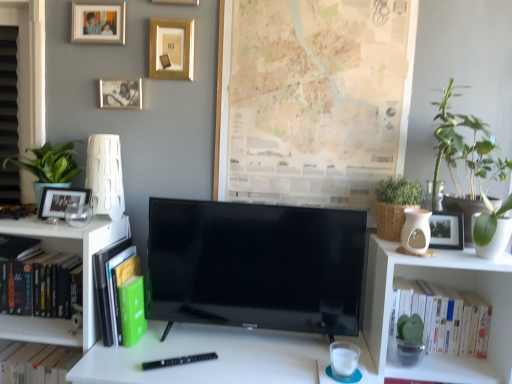
The image size is (512, 384). In order to click on white matte desk at center in this screenshot , I will do `click(209, 361)`.

Find the location of a particular element. The height and width of the screenshot is (384, 512). beige paper map at upper center is located at coordinates (313, 99).

What do you see at coordinates (113, 285) in the screenshot? This screenshot has width=512, height=384. I see `green matte book at left, placed as the 2th book when sorted from left to right` at bounding box center [113, 285].

The image size is (512, 384). What do you see at coordinates (395, 205) in the screenshot?
I see `green woven basket at right, positioned as the 2th houseplant in right-to-left order` at bounding box center [395, 205].

Find the location of a particular element. The width and height of the screenshot is (512, 384). matte gold picture frame at upper left, the 2th picture frame in the top-to-bottom sequence is located at coordinates [98, 23].

Identify the location of black matte picture frame at upper left, the second picture frame in the bottom-to-top sequence. The height and width of the screenshot is (384, 512). (121, 94).

Is green leafy plant at right, which is counted as the third houseplant, starting from the left, oriented towards beige paper map at upper center?

No.

Looking at the image, does green leafy plant at right, which is the first houseplant in right-to-left order, seem bigger or smaller compared to beige paper map at upper center?

Clearly, green leafy plant at right, which is the first houseplant in right-to-left order, is larger in size than beige paper map at upper center.

Is point (487, 154) closer or farther from the camera than point (284, 133)?

Point (487, 154) appears to be closer to the viewer than point (284, 133).

From the image's perspective, is green matte book at left, the second book from the right, over hardcover book at left, which is counted as the 1th book, starting from the left?

No, from the image's perspective, green matte book at left, the second book from the right, is not over hardcover book at left, which is counted as the 1th book, starting from the left.

In the scene shown: From a real-world perspective, is green matte book at left, placed as the 2th book when sorted from left to right, physically located above or below hardcover book at left, placed as the 3th book when sorted from right to left?

green matte book at left, placed as the 2th book when sorted from left to right, is situated higher than hardcover book at left, placed as the 3th book when sorted from right to left, in the real world.

In the scene shown: Are green matte book at left, the second book from the right, and hardcover book at left, which is counted as the 1th book, starting from the left, making contact?

No, green matte book at left, the second book from the right, is not next to hardcover book at left, which is counted as the 1th book, starting from the left.

Is green matte book at left, placed as the 2th book when sorted from left to right, located outside hardcover book at left, which is counted as the 1th book, starting from the left?

green matte book at left, placed as the 2th book when sorted from left to right, is positioned outside hardcover book at left, which is counted as the 1th book, starting from the left.

Does point (170, 1) come behind point (267, 192)?

No.

Is brushed metal picture frame at upper center, the 5th picture frame in the bottom-to-top sequence, to the left of beige paper map at upper center from the viewer's perspective?

Yes, brushed metal picture frame at upper center, the 5th picture frame in the bottom-to-top sequence, is to the left of beige paper map at upper center.

Which object is closer to the camera taking this photo, brushed metal picture frame at upper center, the 5th picture frame in the bottom-to-top sequence, or beige paper map at upper center?

beige paper map at upper center is in front.

Does brushed metal picture frame at upper center, the 5th picture frame in the bottom-to-top sequence, have a lesser height compared to beige paper map at upper center?

Indeed, brushed metal picture frame at upper center, the 5th picture frame in the bottom-to-top sequence, has a lesser height compared to beige paper map at upper center.

Considering the sizes of objects green woven basket at right, arranged as the second houseplant when viewed from the left, and black glossy tv at center in the image provided, who is taller, green woven basket at right, arranged as the second houseplant when viewed from the left, or black glossy tv at center?

With more height is black glossy tv at center.

Is green woven basket at right, arranged as the second houseplant when viewed from the left, positioned with its back to black glossy tv at center?

No, black glossy tv at center is not at the back of green woven basket at right, arranged as the second houseplant when viewed from the left.

Considering their positions, is green woven basket at right, arranged as the second houseplant when viewed from the left, located in front of or behind black glossy tv at center?

green woven basket at right, arranged as the second houseplant when viewed from the left, is behind black glossy tv at center.

Is green leafy plant at upper right inside the boundaries of black glossy tv at center, or outside?

green leafy plant at upper right is spatially situated outside black glossy tv at center.

Is green leafy plant at upper right facing towards black glossy tv at center?

No, green leafy plant at upper right is not facing towards black glossy tv at center.

Based on their sizes in the image, would you say green leafy plant at upper right is bigger or smaller than black glossy tv at center?

green leafy plant at upper right is smaller than black glossy tv at center.

From a real-world perspective, does green leafy plant at upper right stand above black glossy tv at center?

Yes, from a real-world perspective, green leafy plant at upper right is on top of black glossy tv at center.

Is point (75, 171) closer or farther from the camera than point (439, 144)?

Point (75, 171).

How distant is green matte plant at left, which is counted as the 3th houseplant, starting from the right, from green leafy plant at upper right?

A distance of 1.35 meters exists between green matte plant at left, which is counted as the 3th houseplant, starting from the right, and green leafy plant at upper right.

Is green matte plant at left, positioned as the 1th houseplant in left-to-right order, far from green leafy plant at upper right?

green matte plant at left, positioned as the 1th houseplant in left-to-right order, is positioned a significant distance from green leafy plant at upper right.

Is green matte plant at left, positioned as the 1th houseplant in left-to-right order, situated inside green leafy plant at upper right or outside?

green matte plant at left, positioned as the 1th houseplant in left-to-right order, is spatially situated outside green leafy plant at upper right.

Which point is more forward, (x=175, y=73) or (x=239, y=259)?

Point (x=239, y=259)

Who is smaller, gold metallic picture frame at upper center, placed as the 3th picture frame when sorted from top to bottom, or black glossy tv at center?

Smaller between the two is gold metallic picture frame at upper center, placed as the 3th picture frame when sorted from top to bottom.

In terms of width, does gold metallic picture frame at upper center, placed as the 3th picture frame when sorted from top to bottom, look wider or thinner when compared to black glossy tv at center?

Considering their sizes, gold metallic picture frame at upper center, placed as the 3th picture frame when sorted from top to bottom, looks slimmer than black glossy tv at center.

Where is `bulletin board above the green leafy plant at right, which is the first houseplant in right-to-left order (from a real-world perspective)`? bulletin board above the green leafy plant at right, which is the first houseplant in right-to-left order (from a real-world perspective) is located at coordinates (313, 99).

From the image's perspective, count 1st books downward from the hardcover book at left, which is counted as the 1th book, starting from the left, and point to it. Please provide its 2D coordinates.

[(113, 285)]

Based on their spatial positions, is green leafy plant at right, which is counted as the third houseplant, starting from the left, or black glossy tv at center closer to matte gold picture frame at upper left, the fourth picture frame in the bottom-to-top sequence?

Based on the image, black glossy tv at center appears to be nearer to matte gold picture frame at upper left, the fourth picture frame in the bottom-to-top sequence.

In the scene shown: Based on their spatial positions, is black glossy tv at center or green leafy plant at right, which is counted as the third houseplant, starting from the left, closer to brushed metal picture frame at upper center, the 5th picture frame in the bottom-to-top sequence?

Among the two, black glossy tv at center is located nearer to brushed metal picture frame at upper center, the 5th picture frame in the bottom-to-top sequence.

From the image, which object appears to be nearer to green matte plant at left, which is counted as the 3th houseplant, starting from the right, black glossy tv at center or beige paper map at upper center?

black glossy tv at center is positioned closer to the anchor green matte plant at left, which is counted as the 3th houseplant, starting from the right.

Which object lies further to the anchor point green leafy plant at right, which is the first houseplant in right-to-left order, matte gold picture frame at upper left, the fourth picture frame in the bottom-to-top sequence, or gold metallic picture frame at upper center, acting as the third picture frame starting from the bottom?

Based on the image, matte gold picture frame at upper left, the fourth picture frame in the bottom-to-top sequence, appears to be further to green leafy plant at right, which is the first houseplant in right-to-left order.

Looking at the image, which one is located closer to white matte book at right, which is the first book from right to left, green matte flowerpot at right or beige paper map at upper center?

The object closer to white matte book at right, which is the first book from right to left, is green matte flowerpot at right.

When comparing their distances from beige paper map at upper center, does green woven basket at right, arranged as the second houseplant when viewed from the left, or green matte book at left, placed as the 2th book when sorted from left to right, seem further?

green matte book at left, placed as the 2th book when sorted from left to right, is positioned further to the anchor beige paper map at upper center.

Consider the image. Estimate the real-world distances between objects in this image. Which object is closer to brushed metal picture frame at upper center, which ranks as the 1th picture frame in top-to-bottom order, green leafy plant at right, which is counted as the third houseplant, starting from the left, or black matte picture frame at upper left, the second picture frame in the bottom-to-top sequence?

black matte picture frame at upper left, the second picture frame in the bottom-to-top sequence, is positioned closer to the anchor brushed metal picture frame at upper center, which ranks as the 1th picture frame in top-to-bottom order.

Which object lies further to the anchor point beige paper map at upper center, green woven basket at right, arranged as the second houseplant when viewed from the left, or green matte plant at left, which is counted as the 3th houseplant, starting from the right?

green matte plant at left, which is counted as the 3th houseplant, starting from the right.

At what (x,y) coordinates should I click in order to perform the action: click on plant located between black glossy tv at center and green matte flowerpot at right in the left-right direction. Please return your answer as a coordinate pair (x, y). This screenshot has height=384, width=512. Looking at the image, I should click on (447, 141).

I want to click on bulletin board situated between brushed metal picture frame at upper center, which ranks as the 1th picture frame in top-to-bottom order, and green leafy plant at right, which is counted as the third houseplant, starting from the left, from left to right, so click(313, 99).

Find the location of a particular element. The image size is (512, 384). plant between matte gold picture frame at upper left, the 2th picture frame in the top-to-bottom sequence, and white matte book at right, the third book positioned from the left is located at coordinates (447, 141).

Locate an element on the screen. The width and height of the screenshot is (512, 384). picture frame between gold metallic picture frame at upper center, acting as the third picture frame starting from the bottom, and green matte plant at left, which is counted as the 3th houseplant, starting from the right, vertically is located at coordinates (121, 94).